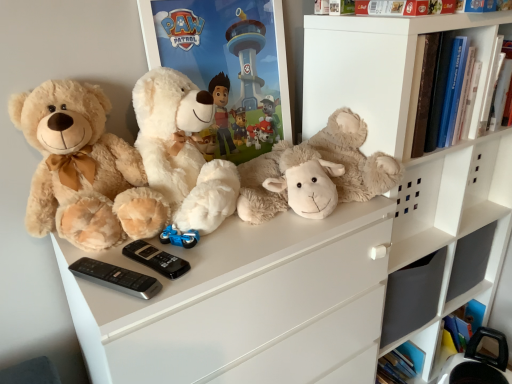
Question: Should I look upward or downward to see soft beige teddy bear at left, the first teddy bear from the left?

Choices:
 (A) down
 (B) up

Answer: (B)

Question: From a real-world perspective, is white matte shelf at upper right under fluffy white teddy bear at center, the second teddy bear in the right-to-left sequence?

Choices:
 (A) yes
 (B) no

Answer: (B)

Question: Considering the relative sizes of white matte shelf at upper right and fluffy white teddy bear at center, the second teddy bear in the right-to-left sequence, in the image provided, is white matte shelf at upper right bigger than fluffy white teddy bear at center, the second teddy bear in the right-to-left sequence,?

Choices:
 (A) no
 (B) yes

Answer: (B)

Question: Does white matte shelf at upper right touch fluffy white teddy bear at center, acting as the 2th teddy bear starting from the left?

Choices:
 (A) yes
 (B) no

Answer: (B)

Question: Does white matte shelf at upper right turn towards fluffy white teddy bear at center, acting as the 2th teddy bear starting from the left?

Choices:
 (A) no
 (B) yes

Answer: (A)

Question: From a real-world perspective, is white matte shelf at upper right on fluffy white teddy bear at center, the second teddy bear in the right-to-left sequence?

Choices:
 (A) yes
 (B) no

Answer: (A)

Question: Is white matte shelf at upper right taller than fluffy white teddy bear at center, the second teddy bear in the right-to-left sequence?

Choices:
 (A) yes
 (B) no

Answer: (B)

Question: Considering the relative sizes of black plastic remote at center, arranged as the first control when viewed from the back, and fluffy white teddy bear at center, the second teddy bear in the right-to-left sequence, in the image provided, is black plastic remote at center, arranged as the first control when viewed from the back, thinner than fluffy white teddy bear at center, the second teddy bear in the right-to-left sequence,?

Choices:
 (A) no
 (B) yes

Answer: (B)

Question: Does black plastic remote at center, arranged as the first control when viewed from the back, have a greater height compared to fluffy white teddy bear at center, acting as the 2th teddy bear starting from the left?

Choices:
 (A) no
 (B) yes

Answer: (A)

Question: Does black plastic remote at center, arranged as the first control when viewed from the back, have a smaller size compared to fluffy white teddy bear at center, acting as the 2th teddy bear starting from the left?

Choices:
 (A) yes
 (B) no

Answer: (A)

Question: Is black plastic remote at center, arranged as the first control when viewed from the back, turned away from fluffy white teddy bear at center, acting as the 2th teddy bear starting from the left?

Choices:
 (A) no
 (B) yes

Answer: (A)

Question: Does black plastic remote at center, arranged as the first control when viewed from the back, appear on the right side of fluffy white teddy bear at center, the second teddy bear in the right-to-left sequence?

Choices:
 (A) no
 (B) yes

Answer: (A)

Question: From a real-world perspective, is black plastic remote at center, arranged as the first control when viewed from the back, physically above fluffy white teddy bear at center, acting as the 2th teddy bear starting from the left?

Choices:
 (A) no
 (B) yes

Answer: (A)

Question: Is fluffy white teddy bear at center, acting as the 2th teddy bear starting from the left, positioned in front of white matte shelf at upper right?

Choices:
 (A) yes
 (B) no

Answer: (A)